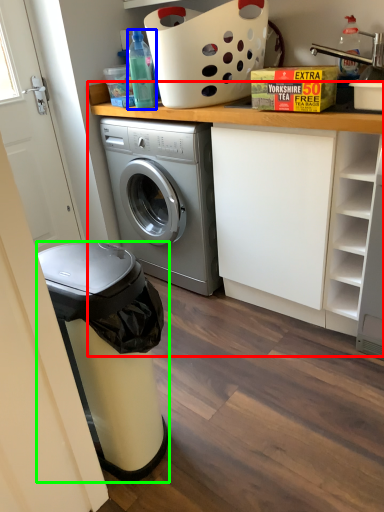
Question: Which is nearer to the counter (highlighted by a red box)? bottle (highlighted by a blue box) or dish washer (highlighted by a green box).

Choices:
 (A) bottle
 (B) dish washer

Answer: (A)